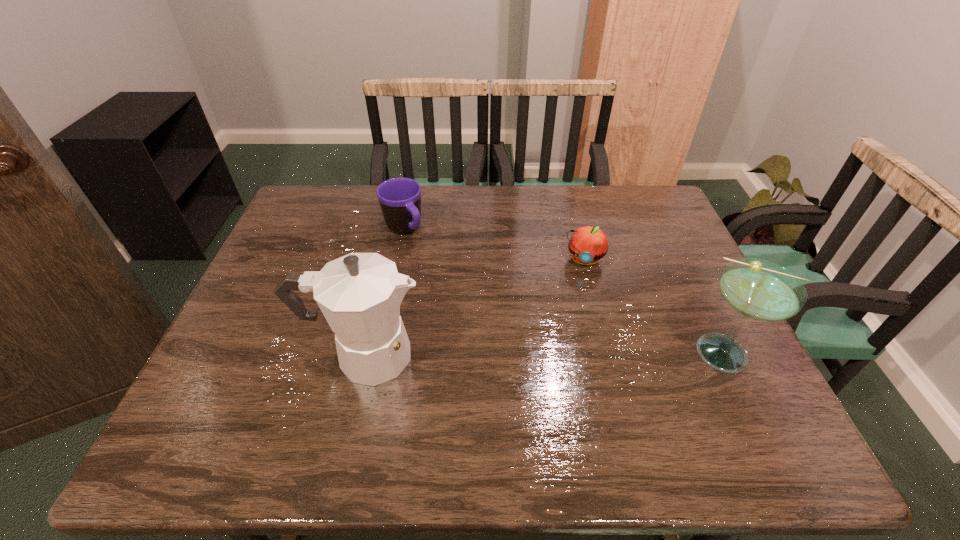
At what (x,y) coordinates should I click in order to perform the action: click on free spot on the desktop that is between the coffeepot and the rightmost object and is positioned on the surface of the apple. Please return your answer as a coordinate pair (x, y). The image size is (960, 540). Looking at the image, I should click on (562, 354).

Image resolution: width=960 pixels, height=540 pixels. In order to click on vacant space on the desktop that is between the tallest object and the rightmost object and is positioned with the handle on the side of the mug in this screenshot , I will do `click(511, 354)`.